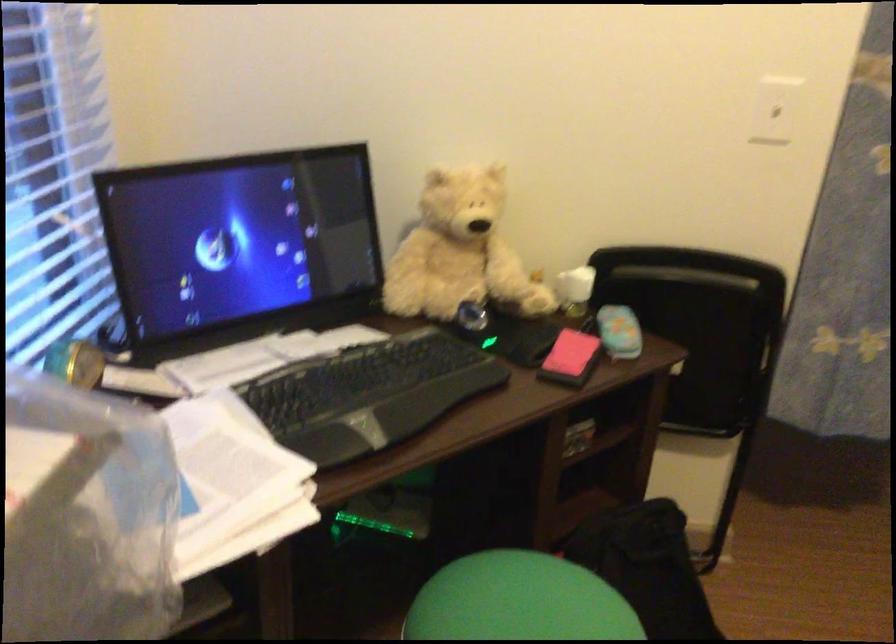
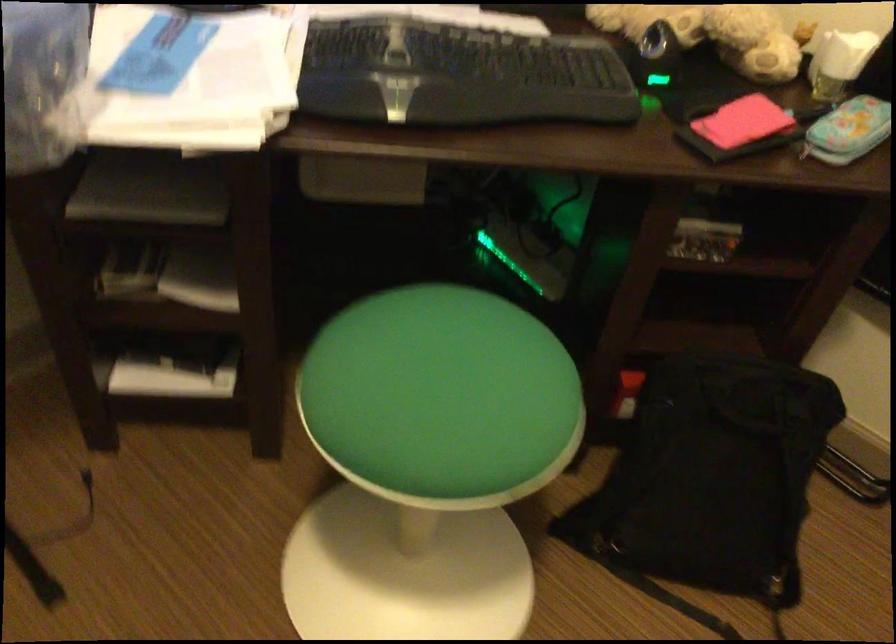
Where in the second image is the point corresponding to (x=581, y=357) from the first image?

(739, 128)